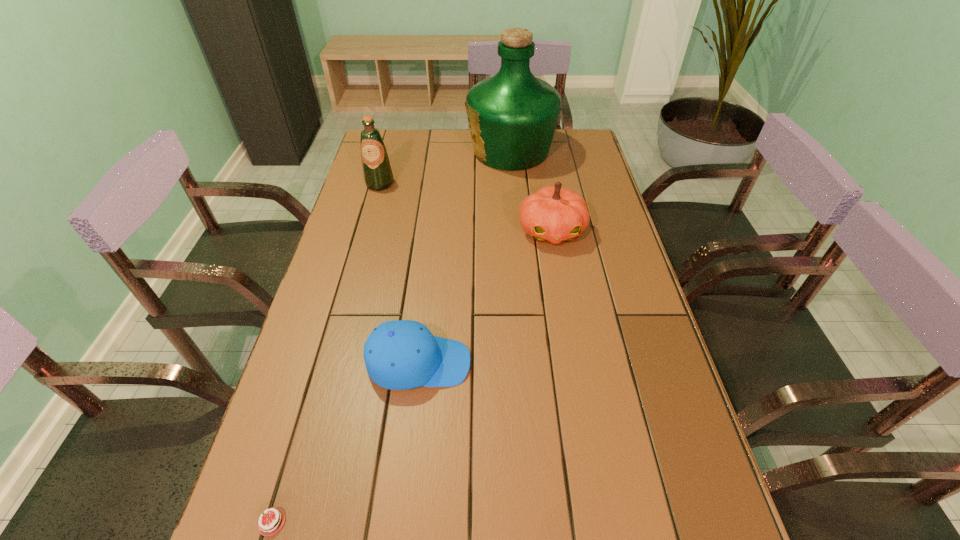
Where is `liquor`? liquor is located at coordinates (512, 116).

Find the location of a particular element. This screenshot has width=960, height=540. olive oil is located at coordinates (377, 172).

Find the location of a particular element. pumpkin is located at coordinates (552, 214).

Identify the location of the third farthest object. The height and width of the screenshot is (540, 960). (552, 214).

Where is `cap`? This screenshot has height=540, width=960. cap is located at coordinates (402, 354).

Image resolution: width=960 pixels, height=540 pixels. I want to click on the second nearest object, so click(402, 354).

Identify the location of vacant area located 0.170m on the label side of the liquor. (420, 152).

This screenshot has width=960, height=540. In order to click on blank space located on the label side of the liquor in this screenshot , I will do `click(395, 152)`.

The width and height of the screenshot is (960, 540). I want to click on vacant region located on the label side of the liquor, so click(x=381, y=152).

What are the coordinates of `vacant space located on the front-facing side of the fourth shortest object` in the screenshot? It's located at (363, 246).